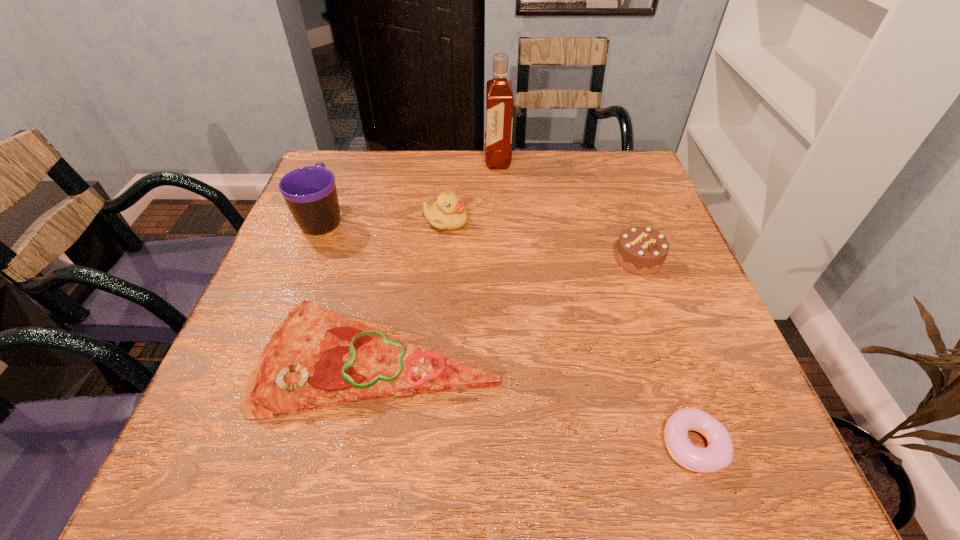
The width and height of the screenshot is (960, 540). What are the coordinates of `mug situated at the left edge` in the screenshot? It's located at (310, 192).

You are a GUI agent. You are given a task and a screenshot of the screen. Output one action in this format:
    pyautogui.click(x=<x>, y=<y>)
    Task: Click on the pizza situated at the left edge
    Image resolution: width=960 pixels, height=540 pixels.
    Given the screenshot: What is the action you would take?
    pyautogui.click(x=316, y=358)

The width and height of the screenshot is (960, 540). Identify the location of chocolate cake at the right edge. (640, 250).

Where is `doughnut that is at the right edge`? This screenshot has height=540, width=960. doughnut that is at the right edge is located at coordinates (719, 453).

Locate an element on the screen. object positioned at the far left corner is located at coordinates (310, 192).

Identify the location of object present at the near right corner. (719, 453).

At what (x,y) coordinates should I click in order to perform the action: click on free spot at the far edge of the desktop. Please return your answer as a coordinate pair (x, y). Image resolution: width=960 pixels, height=540 pixels. Looking at the image, I should click on (512, 174).

Where is `vacant space at the near edge`? The height and width of the screenshot is (540, 960). vacant space at the near edge is located at coordinates (538, 437).

This screenshot has height=540, width=960. I want to click on free spot at the left edge of the desktop, so click(x=348, y=234).

Locate an element on the screen. This screenshot has height=540, width=960. vacant space at the right edge of the desktop is located at coordinates (639, 275).